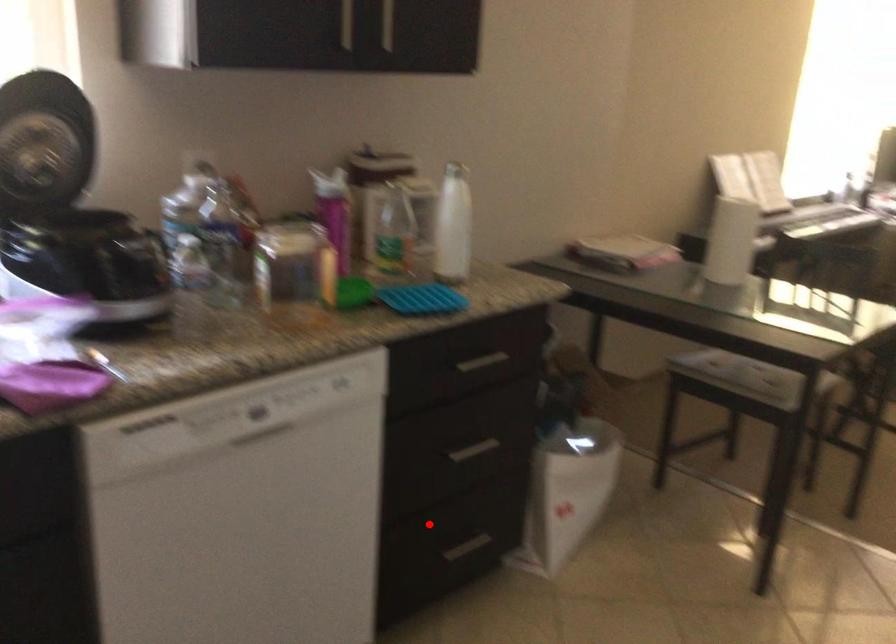
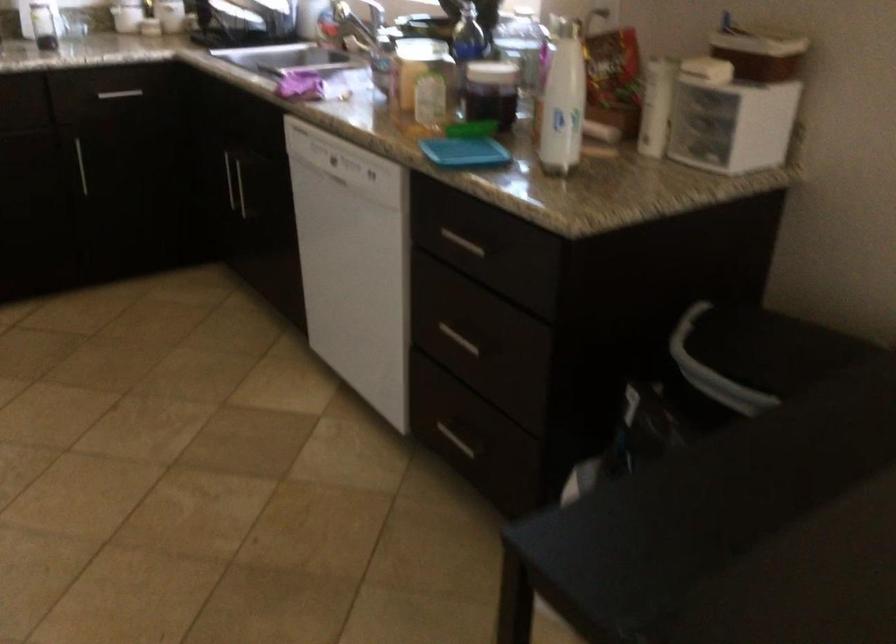
Where in the second image is the point corresponding to the highlighted location from the first image?

(455, 440)